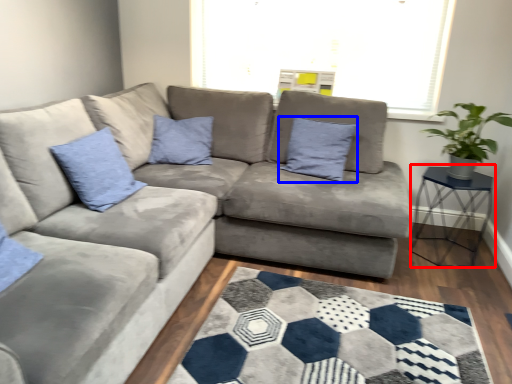
Question: Among these objects, which one is nearest to the camera, table (highlighted by a red box) or pillow (highlighted by a blue box)?

Choices:
 (A) table
 (B) pillow

Answer: (A)